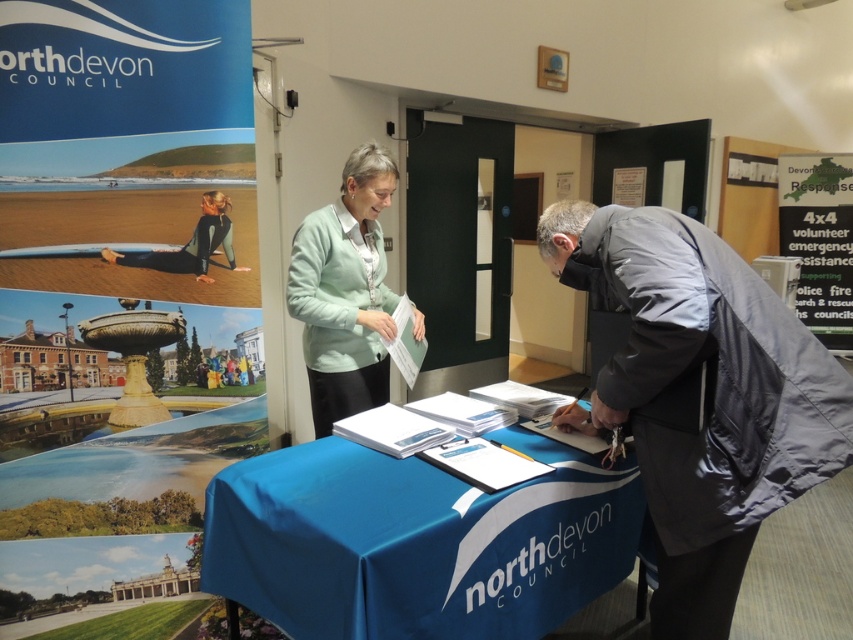
Question: Estimate the real-world distances between objects in this image. Which object is closer to the blue paper at upper left?

Choices:
 (A) blue fabric table at center
 (B) light green fabric at center
 (C) green paper at upper right
 (D) dark gray jacket at lower right

Answer: (B)

Question: Estimate the real-world distances between objects in this image. Which object is closer to the green paper at upper right?

Choices:
 (A) dark gray jacket at lower right
 (B) blue paper at upper left
 (C) blue fabric table at center

Answer: (A)

Question: Is dark gray jacket at lower right smaller than blue fabric table at center?

Choices:
 (A) no
 (B) yes

Answer: (A)

Question: Does light blue fabric tablecloth at center have a smaller size compared to blue fabric table at center?

Choices:
 (A) yes
 (B) no

Answer: (B)

Question: Does blue fabric table at center appear on the left side of light green fabric at center?

Choices:
 (A) yes
 (B) no

Answer: (B)

Question: Which is farther from the green paper at upper right?

Choices:
 (A) dark gray jacket at lower right
 (B) light blue fabric tablecloth at center
 (C) light green fabric at center
 (D) blue fabric table at center

Answer: (D)